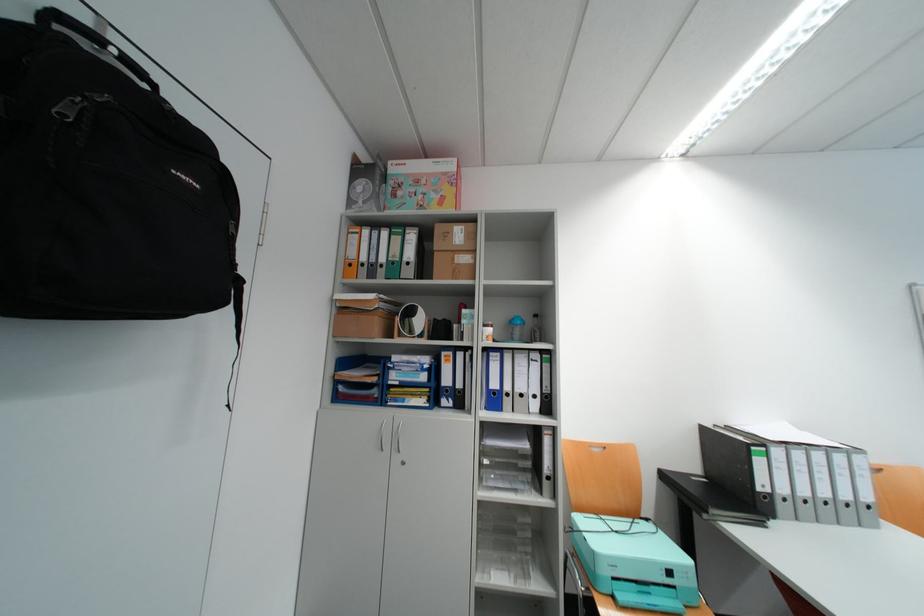
In order to click on blue paper tray in this screenshot , I will do `click(409, 381)`.